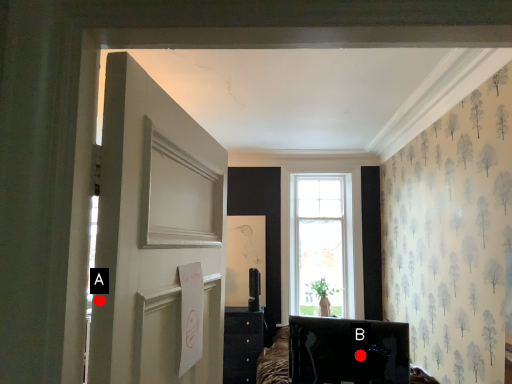
Question: Two points are circled on the image, labeled by A and B beside each circle. Among these points, which one is nearest to the camera?

Choices:
 (A) A is closer
 (B) B is closer

Answer: (A)